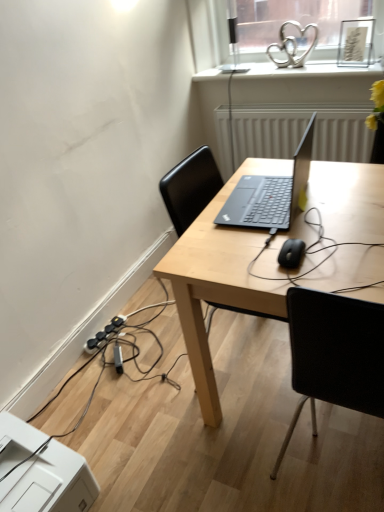
Find the location of a particular element. This screenshot has width=384, height=512. vacant region in front of black matte mouse at center is located at coordinates (319, 278).